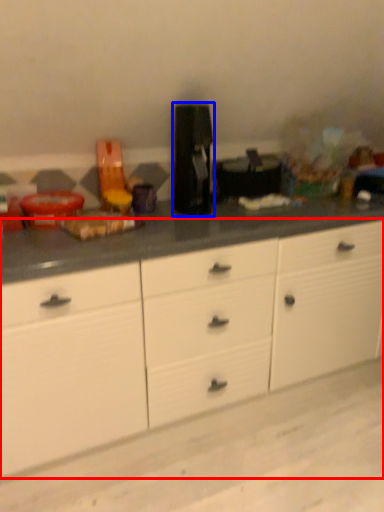
Question: Among these objects, which one is nearest to the camera, cabinetry (highlighted by a red box) or coffee machine (highlighted by a blue box)?

Choices:
 (A) cabinetry
 (B) coffee machine

Answer: (A)